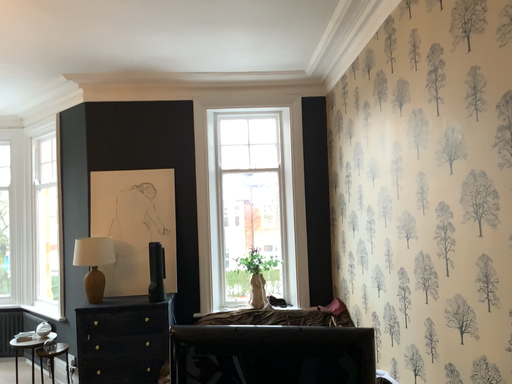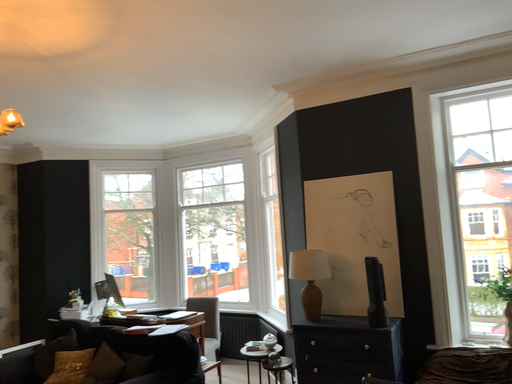
Question: How did the camera likely rotate when shooting the video?

Choices:
 (A) rotated left
 (B) rotated right

Answer: (A)